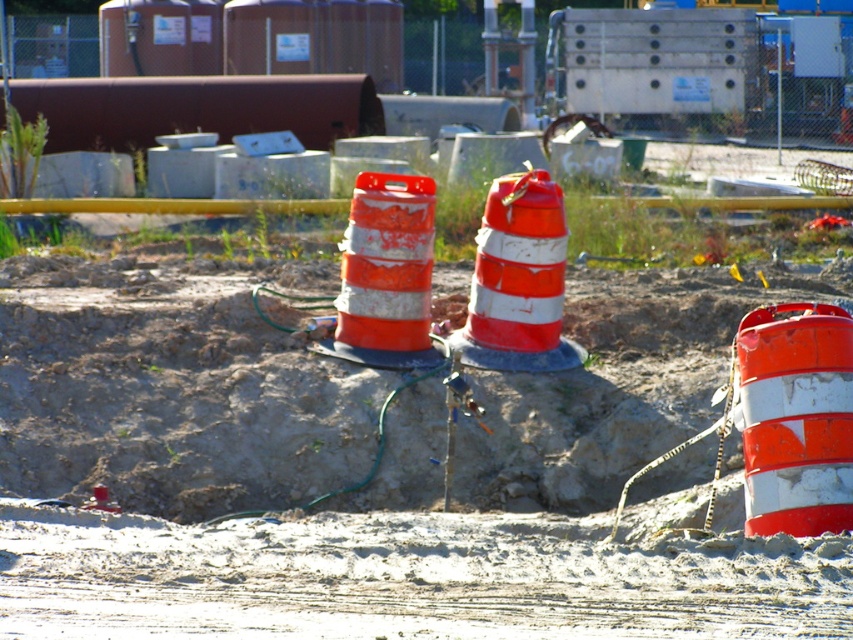
Question: Is orange reflective traffic cone at center thinner than orange/white striped traffic cone at center?

Choices:
 (A) yes
 (B) no

Answer: (B)

Question: Does orange and white striped traffic cone at center lie in front of orange reflective traffic cone at center?

Choices:
 (A) yes
 (B) no

Answer: (A)

Question: Is orange and white striped traffic cone at center in front of orange reflective traffic cone at center?

Choices:
 (A) yes
 (B) no

Answer: (A)

Question: Among these objects, which one is farthest from the camera?

Choices:
 (A) orange/white striped traffic cone at center
 (B) orange and white striped traffic cone at center

Answer: (A)

Question: Among these points, which one is nearest to the camera?

Choices:
 (A) (521, 225)
 (B) (335, 348)

Answer: (B)

Question: Which point is closer to the camera?

Choices:
 (A) orange reflective traffic cone at center
 (B) orange and white striped traffic cone at center

Answer: (B)